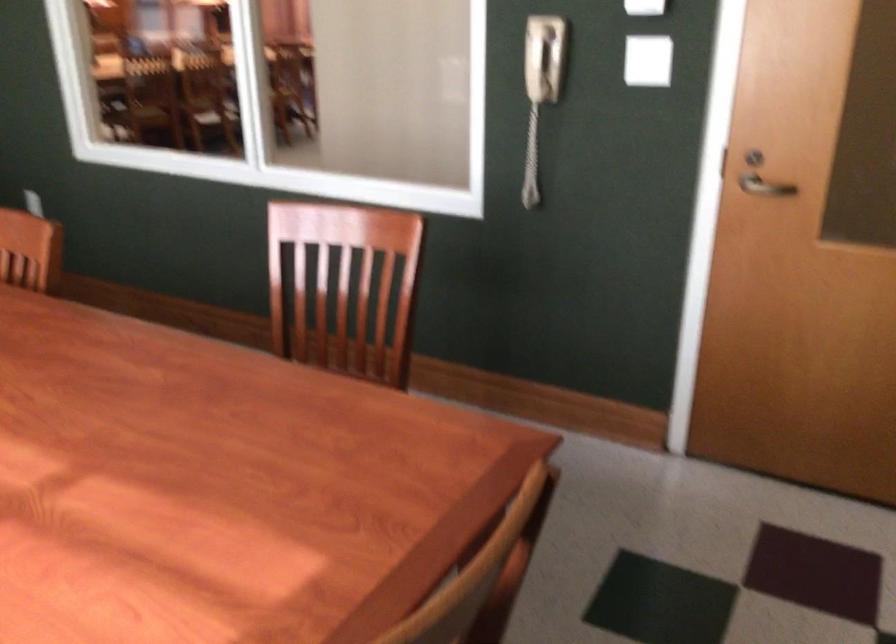
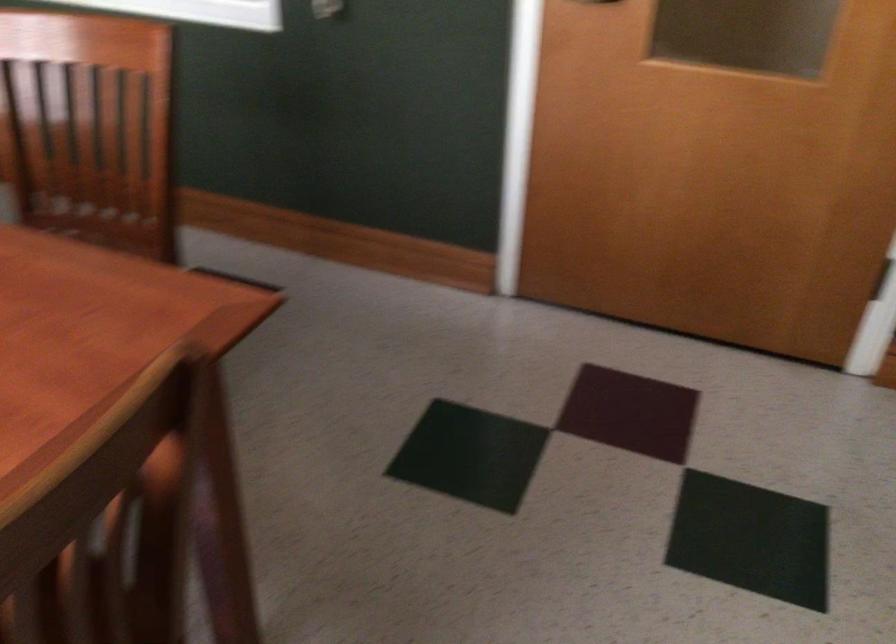
Which direction would the cameraman need to move to produce the second image?

The cameraman moved toward right, forward.